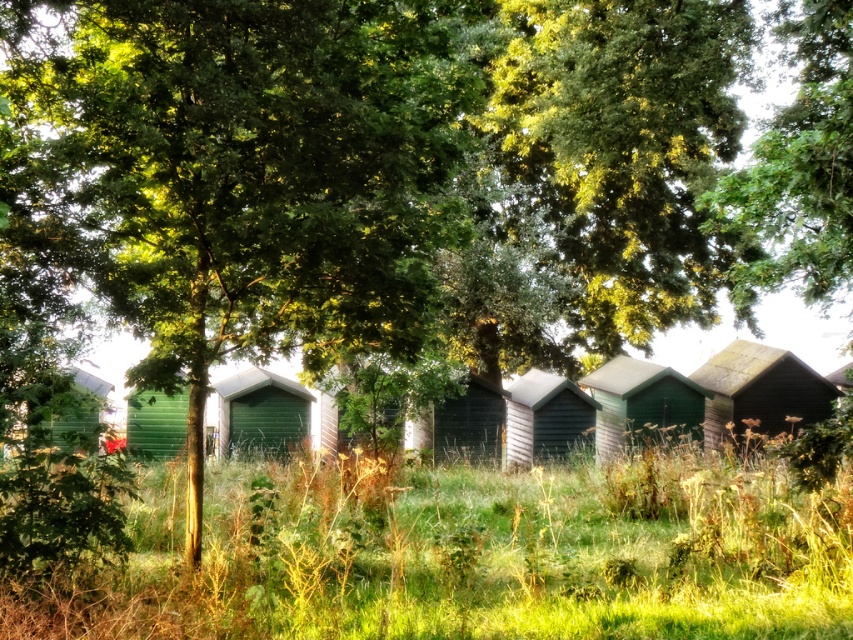
You are standing at the point labeled point (210, 614) and want to walk to the nearest wooden structure. The path between them is 6.18 meters. If your walking speed is 1.5 meters per second, how many seconds will it take you to reach the nearest wooden structure?

The distance between the point (210, 614) and the nearest wooden structure is 6.18 meters. At a speed of 1.5 meters per second, it will take 6.18 divided by 1.5, which equals approximately 4.12 seconds to reach the wooden structure.

You are standing in the middle of the garden and want to walk to both the point at coordinates (729, 476) and the point at (88, 378). Which point will you reach first?

You will reach point (729, 476) first because it is closer to you than point (88, 378).

You are standing in the middle of the tall grass and want to reach the green wooden hut at center. There is a green wood tree at center blocking your path. Can you walk around it to get to the hut?

The green wood tree at center is closer to the viewer than the green wooden hut at center, so you can walk around the green wood tree at center to reach the green wooden hut at center.